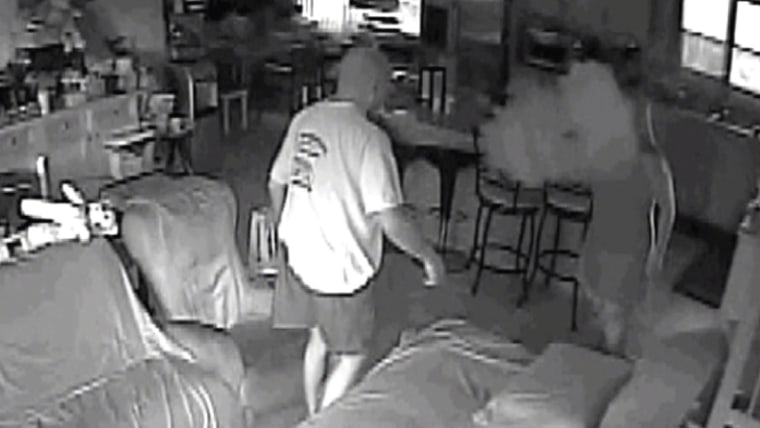
This screenshot has width=760, height=428. I want to click on windows, so click(x=703, y=50), click(x=399, y=16).